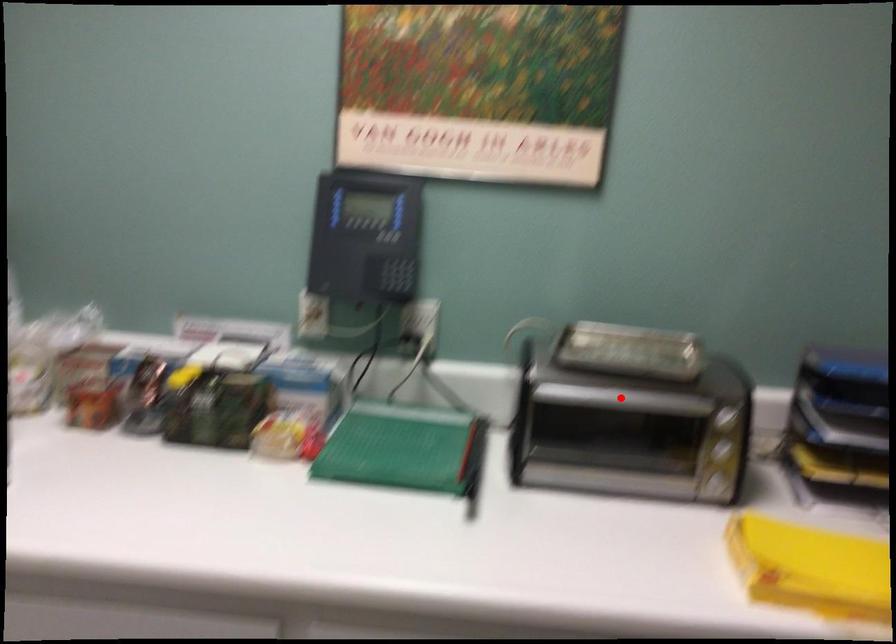
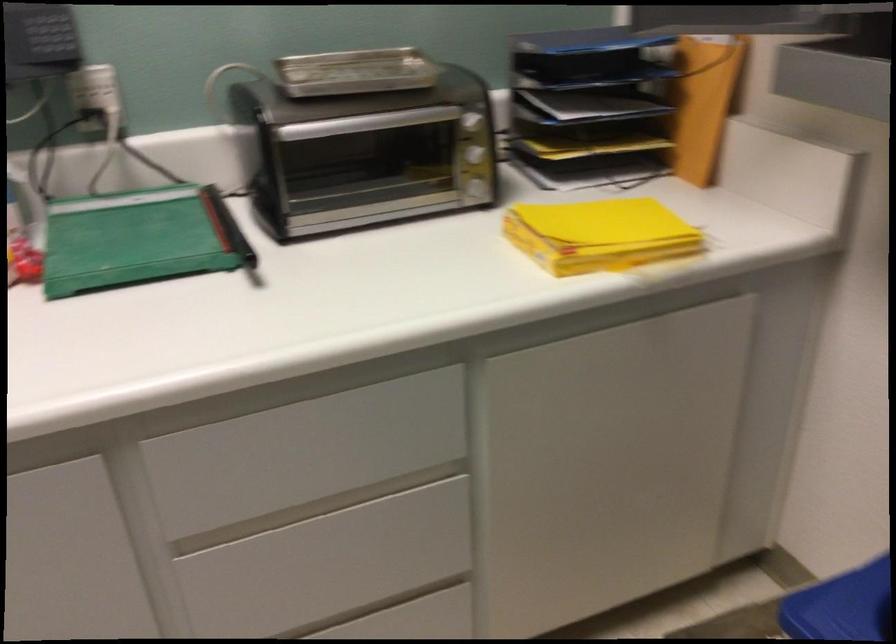
Question: I am providing you with two images of the same scene from different viewpoints. A red point is marked on the first image. Is the red point's position out of view in image 2?

Choices:
 (A) Yes
 (B) No

Answer: (B)